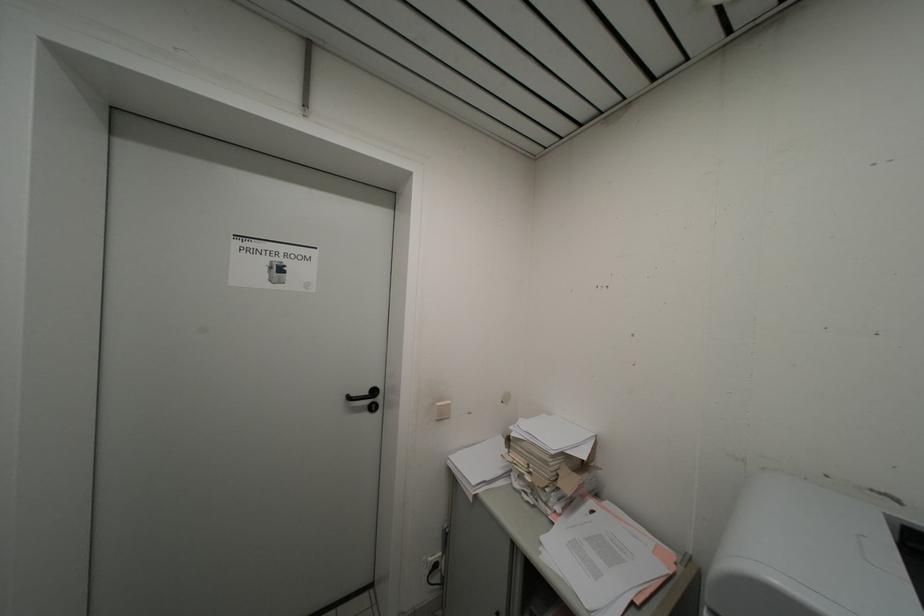
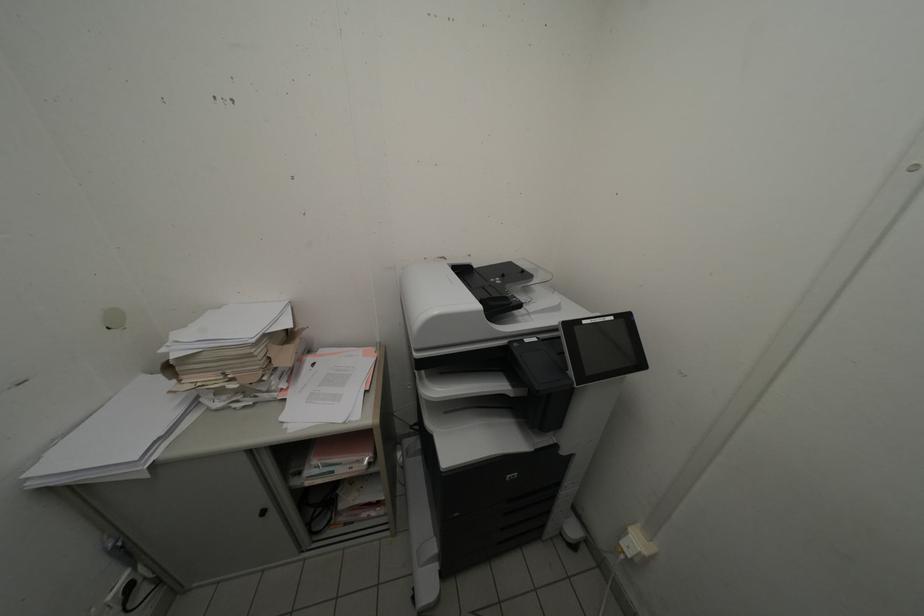
How did the camera likely rotate?

The camera's rotation is toward right-down.